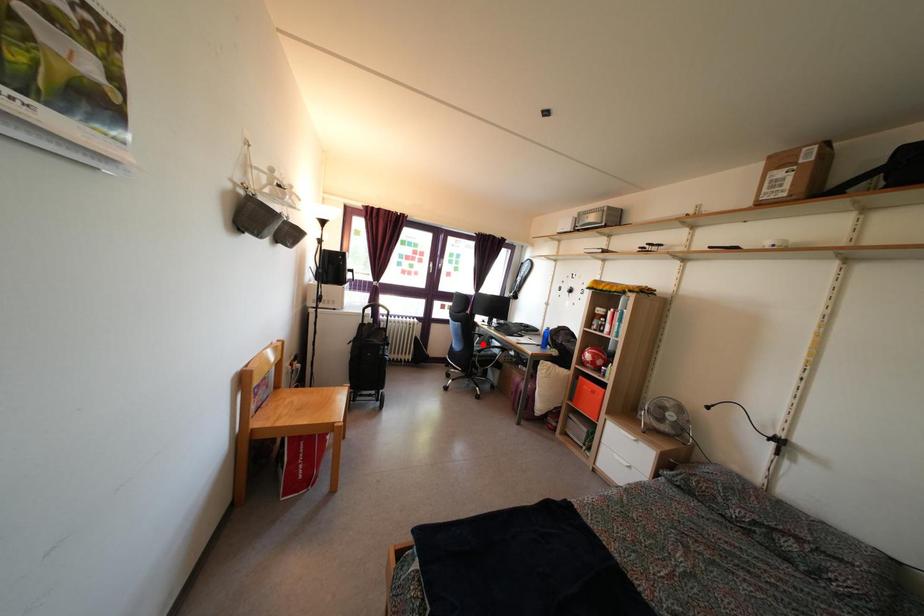
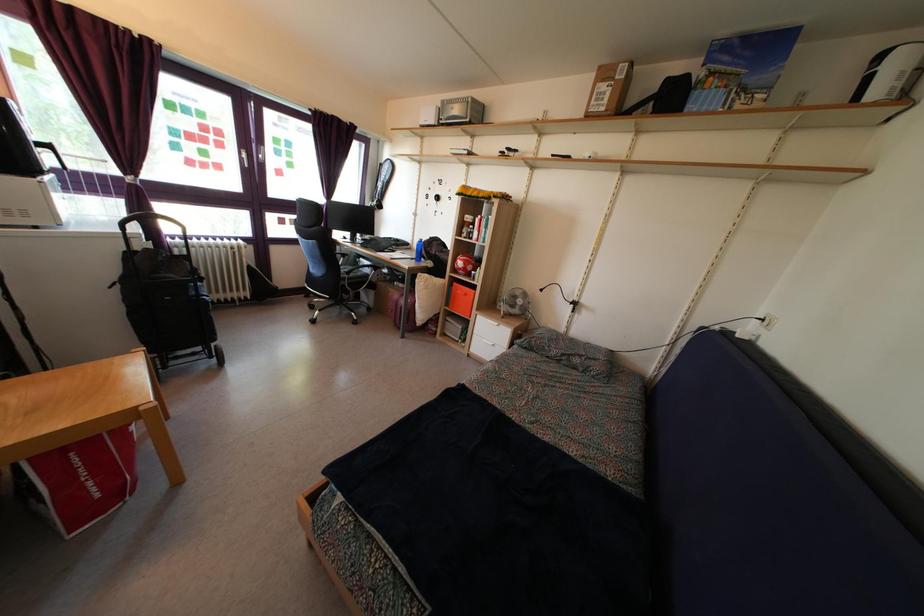
Question: I am providing you with two images of the same scene from different viewpoints. Image1 has a red point marked. In image2, the corresponding 3D location appears at what relative position? Reply with the corresponding letter.

Choices:
 (A) Closer
 (B) Farther

Answer: (A)